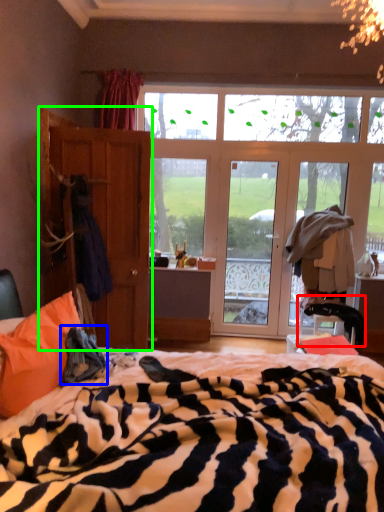
Question: Which is nearer to the swivel chair (highlighted by a red box)? cloth (highlighted by a blue box) or armoire (highlighted by a green box).

Choices:
 (A) cloth
 (B) armoire

Answer: (B)